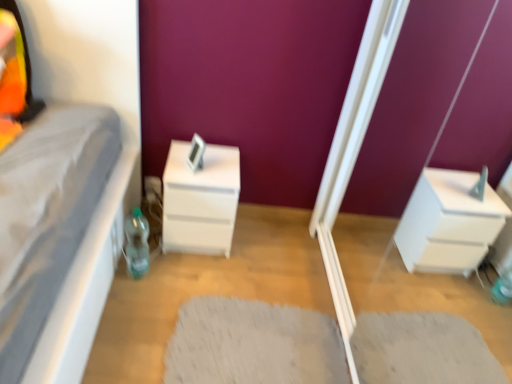
Measure the distance between white matte chest of drawers at center and camera.

white matte chest of drawers at center is 5.45 feet away from camera.

Find the location of a particular element. This screenshot has width=512, height=384. white glossy screen door at lower right is located at coordinates (354, 153).

This screenshot has width=512, height=384. I want to click on white shaggy rug at center, so click(253, 344).

At what (x,y) coordinates should I click in order to perform the action: click on translucent plastic bottle at lower left. Please return your answer as a coordinate pair (x, y). Image resolution: width=512 pixels, height=384 pixels. Looking at the image, I should click on (137, 243).

Which is closer to the camera, (281, 368) or (170, 240)?

Point (281, 368) is positioned closer to the camera compared to point (170, 240).

Consider the image. Can you confirm if white shaggy rug at center is shorter than white matte chest of drawers at center?

Yes.

Is white shaggy rug at center inside or outside of white matte chest of drawers at center?

white shaggy rug at center is spatially situated outside white matte chest of drawers at center.

From the image's perspective, is translucent plastic bottle at lower left located above white glossy screen door at lower right?

No, from the image's perspective, translucent plastic bottle at lower left is not above white glossy screen door at lower right.

Identify the location of screen door that is above the translucent plastic bottle at lower left (from the image's perspective). The width and height of the screenshot is (512, 384). (354, 153).

From the picture: Visually, is translucent plastic bottle at lower left positioned to the left or to the right of white glossy screen door at lower right?

translucent plastic bottle at lower left is positioned on white glossy screen door at lower right's left side.

Is white matte chest of drawers at center spatially inside white glossy screen door at lower right, or outside of it?

white matte chest of drawers at center is located beyond the bounds of white glossy screen door at lower right.

In the scene shown: Which is farther from the camera, (x=182, y=163) or (x=347, y=127)?

Positioned behind is point (x=347, y=127).

The image size is (512, 384). I want to click on screen door in front of the white matte chest of drawers at center, so click(x=354, y=153).

From a real-world perspective, who is located higher, white matte chest of drawers at center or white glossy screen door at lower right?

white glossy screen door at lower right, from a real-world perspective.

Does white matte chest of drawers at center lie in front of white shaggy rug at center?

No, white matte chest of drawers at center is further to the viewer.

Is white matte chest of drawers at center aimed at white shaggy rug at center?

Yes, white matte chest of drawers at center is oriented towards white shaggy rug at center.

From a real-world perspective, which object rests below the other?

white shaggy rug at center.

Is white matte chest of drawers at center spatially inside white shaggy rug at center, or outside of it?

The correct answer is: outside.

Do you think white glossy screen door at lower right is within white matte chest of drawers at center, or outside of it?

white glossy screen door at lower right is not inside white matte chest of drawers at center, it's outside.

From the image's perspective, which object appears higher, white glossy screen door at lower right or white matte chest of drawers at center?

white glossy screen door at lower right.

Considering the positions of objects white glossy screen door at lower right and white matte chest of drawers at center in the image provided, who is in front, white glossy screen door at lower right or white matte chest of drawers at center?

white glossy screen door at lower right is closer to the camera.

Measure the distance between white glossy screen door at lower right and white matte chest of drawers at center.

white glossy screen door at lower right is 23.25 inches away from white matte chest of drawers at center.

Identify the location of bottle lying above the white shaggy rug at center (from the image's perspective). (137, 243).

Is white shaggy rug at center to the left of translucent plastic bottle at lower left from the viewer's perspective?

No.

Which of these two, white shaggy rug at center or translucent plastic bottle at lower left, stands shorter?

white shaggy rug at center is shorter.

What's the angular difference between white shaggy rug at center and translucent plastic bottle at lower left's facing directions?

The angle between the facing direction of white shaggy rug at center and the facing direction of translucent plastic bottle at lower left is 113 degrees.

Based on the photo, is translucent plastic bottle at lower left wider than white shaggy rug at center?

No.

Considering the positions of objects translucent plastic bottle at lower left and white shaggy rug at center in the image provided, who is more to the left, translucent plastic bottle at lower left or white shaggy rug at center?

translucent plastic bottle at lower left.

How far apart are translucent plastic bottle at lower left and white shaggy rug at center?

translucent plastic bottle at lower left and white shaggy rug at center are 19.78 inches apart.

Which object is closer to the camera taking this photo, translucent plastic bottle at lower left or white shaggy rug at center?

Positioned in front is white shaggy rug at center.

Image resolution: width=512 pixels, height=384 pixels. In order to click on chest of drawers above the white shaggy rug at center (from a real-world perspective) in this screenshot , I will do `click(200, 200)`.

Where is `screen door on the right of translucent plastic bottle at lower left`? This screenshot has width=512, height=384. screen door on the right of translucent plastic bottle at lower left is located at coordinates (354, 153).

Looking at the image, which one is located closer to white glossy screen door at lower right, white shaggy rug at center or translucent plastic bottle at lower left?

Based on the image, white shaggy rug at center appears to be nearer to white glossy screen door at lower right.

Which object lies further to the anchor point translucent plastic bottle at lower left, white glossy screen door at lower right or white shaggy rug at center?

white glossy screen door at lower right.

Looking at this image, estimate the real-world distances between objects in this image. Which object is closer to translucent plastic bottle at lower left, white shaggy rug at center or white matte chest of drawers at center?

white matte chest of drawers at center.

Considering their positions, is translucent plastic bottle at lower left positioned further to white glossy screen door at lower right than white shaggy rug at center?

Result: Among the two, translucent plastic bottle at lower left is located further to white glossy screen door at lower right.

When comparing their distances from white glossy screen door at lower right, does white matte chest of drawers at center or translucent plastic bottle at lower left seem further?

Based on the image, translucent plastic bottle at lower left appears to be further to white glossy screen door at lower right.

From the image, which object appears to be nearer to white shaggy rug at center, white matte chest of drawers at center or white glossy screen door at lower right?

white glossy screen door at lower right lies closer to white shaggy rug at center than the other object.

Which object lies nearer to the anchor point white matte chest of drawers at center, translucent plastic bottle at lower left or white glossy screen door at lower right?

The object closer to white matte chest of drawers at center is translucent plastic bottle at lower left.

From the image, which object appears to be nearer to white glossy screen door at lower right, white shaggy rug at center or white matte chest of drawers at center?

white shaggy rug at center lies closer to white glossy screen door at lower right than the other object.

In order to click on doormat between white glossy screen door at lower right and translucent plastic bottle at lower left from front to back in this screenshot , I will do `click(253, 344)`.

Find the location of a particular element. The width and height of the screenshot is (512, 384). bottle between white glossy screen door at lower right and white matte chest of drawers at center from front to back is located at coordinates (137, 243).

I want to click on doormat positioned between white glossy screen door at lower right and white matte chest of drawers at center from near to far, so click(253, 344).

Where is `bottle between white matte chest of drawers at center and white shaggy rug at center in the up-down direction`? bottle between white matte chest of drawers at center and white shaggy rug at center in the up-down direction is located at coordinates [x=137, y=243].